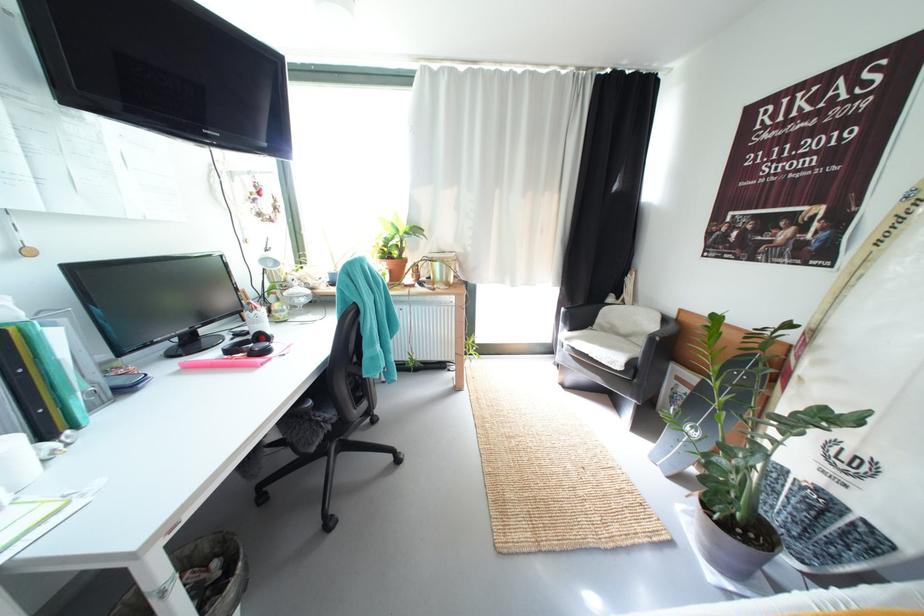
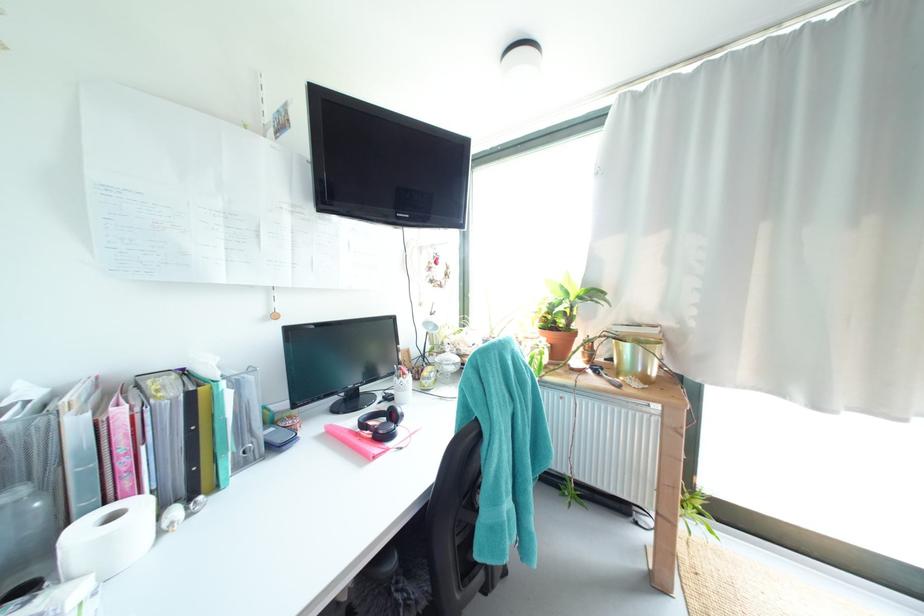
Locate, in the second image, the point that corresponds to point 260,312 in the first image.

(407, 379)